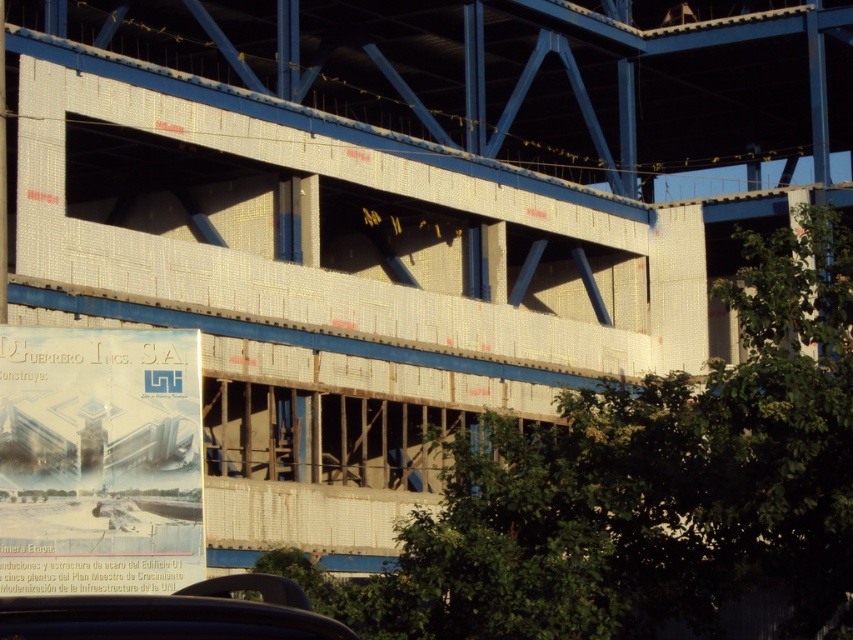
Who is positioned more to the right, white paper poster at center or black matte car at lower center?

From the viewer's perspective, black matte car at lower center appears more on the right side.

Is white paper poster at center closer to the viewer compared to black matte car at lower center?

No, it is behind black matte car at lower center.

Who is more forward, (175, 342) or (264, 630)?

Positioned in front is point (264, 630).

At what (x,y) coordinates should I click in order to perform the action: click on white paper poster at center. Please return your answer as a coordinate pair (x, y). This screenshot has height=640, width=853. Looking at the image, I should click on (99, 460).